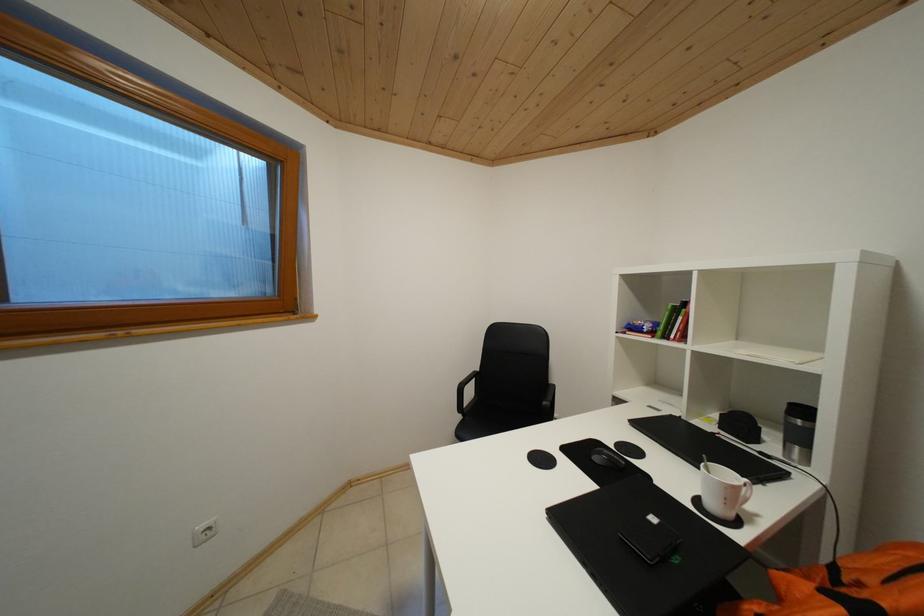
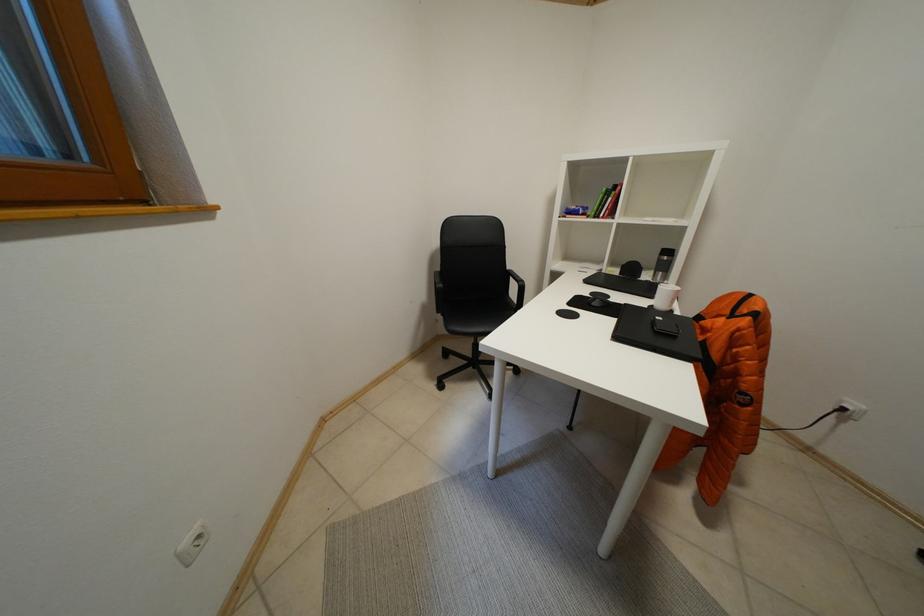
The images are taken continuously from a first-person perspective. In which direction is your viewpoint rotating?

The camera's rotation is toward right-down.